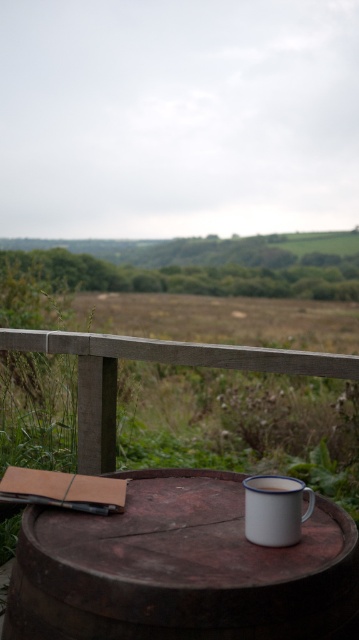
Who is taller, wooden rail at upper center or white enamel mug at lower right?

wooden rail at upper center

Is wooden rail at upper center shorter than white enamel mug at lower right?

Incorrect, wooden rail at upper center's height does not fall short of white enamel mug at lower right's.

At what (x,y) coordinates should I click in order to perform the action: click on wooden rail at upper center. Please return your answer as a coordinate pair (x, y). Looking at the image, I should click on (154, 362).

Is point (257, 573) farther from camera compared to point (267, 518)?

No.

Is rustic wooden barrel at center above white enamel mug at lower right?

Actually, rustic wooden barrel at center is below white enamel mug at lower right.

You are a GUI agent. You are given a task and a screenshot of the screen. Output one action in this format:
    pyautogui.click(x=<x>, y=<y>)
    Task: Click on the rustic wooden barrel at center
    
    Given the screenshot: What is the action you would take?
    pyautogui.click(x=179, y=568)

What are the coordinates of `rustic wooden barrel at center` in the screenshot? It's located at pyautogui.click(x=179, y=568).

This screenshot has height=640, width=359. What do you see at coordinates (179, 568) in the screenshot? I see `rustic wooden barrel at center` at bounding box center [179, 568].

Which is below, rustic wooden barrel at center or wooden rail at upper center?

rustic wooden barrel at center is below.

Locate an element on the screen. Image resolution: width=359 pixels, height=640 pixels. rustic wooden barrel at center is located at coordinates pos(179,568).

Where is `rustic wooden barrel at center`? rustic wooden barrel at center is located at coordinates (179, 568).